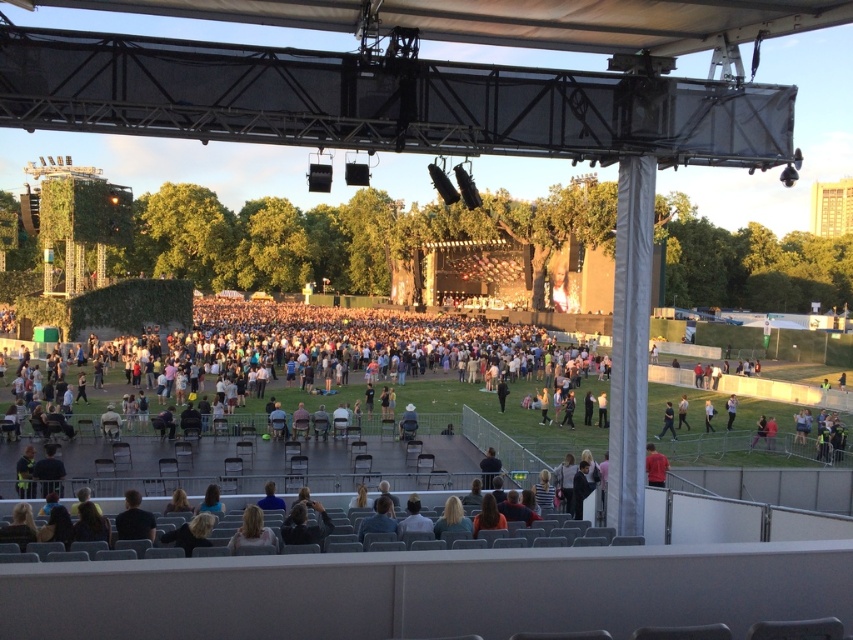
Question: Which point is farther to the camera?

Choices:
 (A) (671, 420)
 (B) (651, 465)

Answer: (A)

Question: Which of the following is the farthest from the observer?

Choices:
 (A) red shirt at center
 (B) black fabric pants at lower right

Answer: (B)

Question: Observing the image, what is the correct spatial positioning of red shirt at center in reference to black fabric pants at lower right?

Choices:
 (A) above
 (B) below

Answer: (B)

Question: Which of the following is the closest to the observer?

Choices:
 (A) red shirt at center
 (B) black fabric pants at lower right

Answer: (A)

Question: Is red shirt at center smaller than black fabric pants at lower right?

Choices:
 (A) yes
 (B) no

Answer: (B)

Question: Can you confirm if red shirt at center is positioned to the right of black fabric pants at lower right?

Choices:
 (A) yes
 (B) no

Answer: (B)